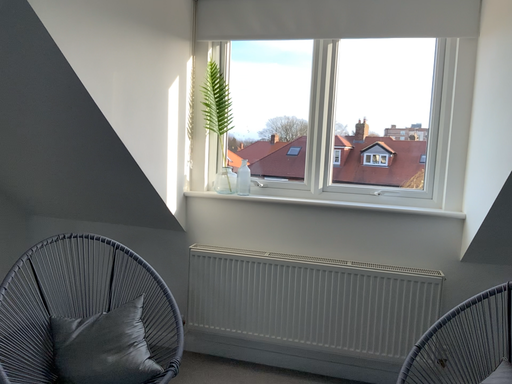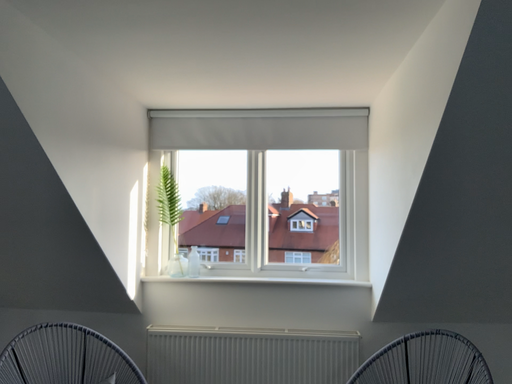
Question: Which way did the camera rotate in the video?

Choices:
 (A) rotated downward
 (B) rotated upward

Answer: (B)